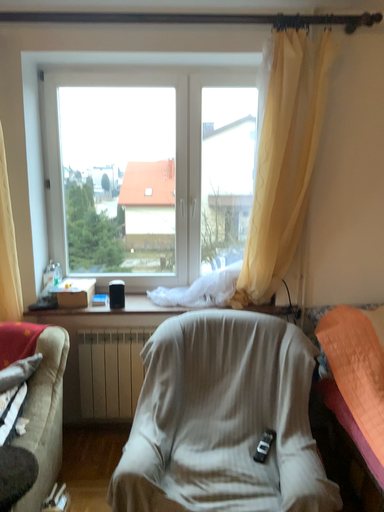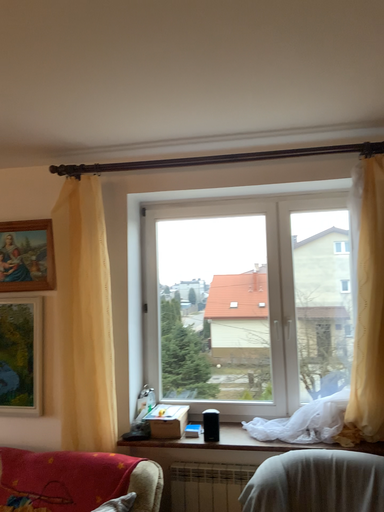
Question: Which way did the camera rotate in the video?

Choices:
 (A) rotated downward
 (B) rotated upward

Answer: (B)